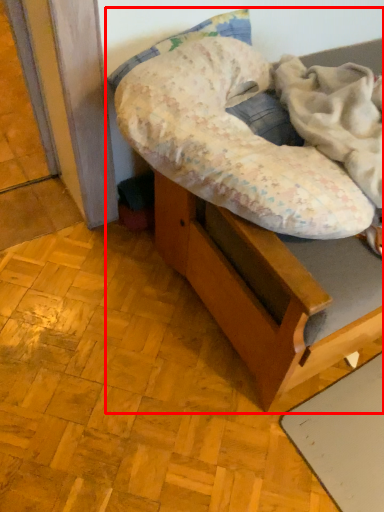
Question: From the image's perspective, where is furniture (annotated by the red box) located in relation to blanket in the image?

Choices:
 (A) above
 (B) below

Answer: (A)